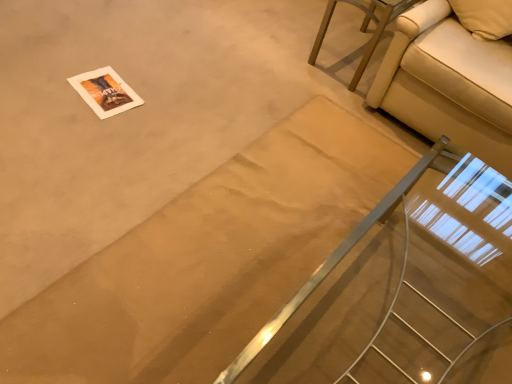
Describe the element at coordinates (448, 84) in the screenshot. This screenshot has height=384, width=512. I see `beige fabric couch at upper right` at that location.

At what (x,y) coordinates should I click in order to perform the action: click on clear glass stairs at center. Please return your answer as a coordinate pair (x, y). This screenshot has width=512, height=384. Looking at the image, I should click on (398, 286).

The image size is (512, 384). Find the location of `beige fabric couch at upper right`. beige fabric couch at upper right is located at coordinates (362, 28).

This screenshot has height=384, width=512. In order to click on beige fabric couch at upper right in this screenshot , I will do `click(448, 84)`.

At what (x,y) coordinates should I click in order to perform the action: click on studio couch to the right of clear glass stairs at center. Please return your answer as a coordinate pair (x, y). This screenshot has height=384, width=512. Looking at the image, I should click on (448, 84).

Does clear glass stairs at center have a smaller size compared to beige fabric couch at upper right?

Yes.

Is beige fabric couch at upper right inside clear glass stairs at center?

No, beige fabric couch at upper right is not inside clear glass stairs at center.

The image size is (512, 384). I want to click on furniture above the beige fabric couch at upper right (from the image's perspective), so click(x=362, y=28).

How much distance is there between beige fabric couch at upper right and beige fabric couch at upper right?

beige fabric couch at upper right is 30.19 inches from beige fabric couch at upper right.

Is beige fabric couch at upper right thinner than beige fabric couch at upper right?

Incorrect, the width of beige fabric couch at upper right is not less than that of beige fabric couch at upper right.

Is beige fabric couch at upper right smaller than beige fabric couch at upper right?

No, beige fabric couch at upper right is not smaller than beige fabric couch at upper right.

Which object is more forward, beige fabric couch at upper right or clear glass stairs at center?

clear glass stairs at center is in front.

Considering the sizes of objects beige fabric couch at upper right and clear glass stairs at center in the image provided, who is smaller, beige fabric couch at upper right or clear glass stairs at center?

Smaller between the two is beige fabric couch at upper right.

Is beige fabric couch at upper right wider or thinner than clear glass stairs at center?

Considering their sizes, beige fabric couch at upper right looks broader than clear glass stairs at center.

Is clear glass stairs at center inside beige fabric couch at upper right?

No, clear glass stairs at center is not a part of beige fabric couch at upper right.

In the image, is beige fabric couch at upper right positioned in front of or behind clear glass stairs at center?

beige fabric couch at upper right is positioned farther from the viewer than clear glass stairs at center.

Considering the relative sizes of beige fabric couch at upper right and clear glass stairs at center in the image provided, is beige fabric couch at upper right smaller than clear glass stairs at center?

No, beige fabric couch at upper right is not smaller than clear glass stairs at center.

From the image's perspective, is beige fabric couch at upper right on clear glass stairs at center?

Yes, from the image's perspective, beige fabric couch at upper right is over clear glass stairs at center.

I want to click on furniture located on the right of clear glass stairs at center, so 362,28.

Based on the photo, which object is positioned more to the left, clear glass stairs at center or beige fabric couch at upper right?

clear glass stairs at center is more to the left.

In terms of height, does clear glass stairs at center look taller or shorter compared to beige fabric couch at upper right?

Clearly, clear glass stairs at center is taller compared to beige fabric couch at upper right.

Does beige fabric couch at upper right turn towards beige fabric couch at upper right?

No, beige fabric couch at upper right is not aimed at beige fabric couch at upper right.

This screenshot has height=384, width=512. I want to click on studio couch located on the right of beige fabric couch at upper right, so click(x=448, y=84).

Is point (370, 42) positioned before point (456, 112)?

No, it is behind (456, 112).

What are the coordinates of `stairs located in front of the beige fabric couch at upper right` in the screenshot? It's located at (398, 286).

I want to click on furniture above the beige fabric couch at upper right (from the image's perspective), so click(x=362, y=28).

From the image, which object appears to be nearer to beige fabric couch at upper right, beige fabric couch at upper right or clear glass stairs at center?

clear glass stairs at center lies closer to beige fabric couch at upper right than the other object.

Estimate the real-world distances between objects in this image. Which object is closer to clear glass stairs at center, beige fabric couch at upper right or beige fabric couch at upper right?

Among the two, beige fabric couch at upper right is located nearer to clear glass stairs at center.

Based on their spatial positions, is clear glass stairs at center or beige fabric couch at upper right closer to beige fabric couch at upper right?

beige fabric couch at upper right lies closer to beige fabric couch at upper right than the other object.

Estimate the real-world distances between objects in this image. Which object is closer to beige fabric couch at upper right, clear glass stairs at center or beige fabric couch at upper right?

The object closer to beige fabric couch at upper right is clear glass stairs at center.

In the scene shown: Based on their spatial positions, is beige fabric couch at upper right or beige fabric couch at upper right further from clear glass stairs at center?

beige fabric couch at upper right is further to clear glass stairs at center.

Estimate the real-world distances between objects in this image. Which object is closer to beige fabric couch at upper right, beige fabric couch at upper right or clear glass stairs at center?

beige fabric couch at upper right is positioned closer to the anchor beige fabric couch at upper right.

Where is `studio couch between beige fabric couch at upper right and clear glass stairs at center from top to bottom`? This screenshot has height=384, width=512. studio couch between beige fabric couch at upper right and clear glass stairs at center from top to bottom is located at coordinates (448, 84).